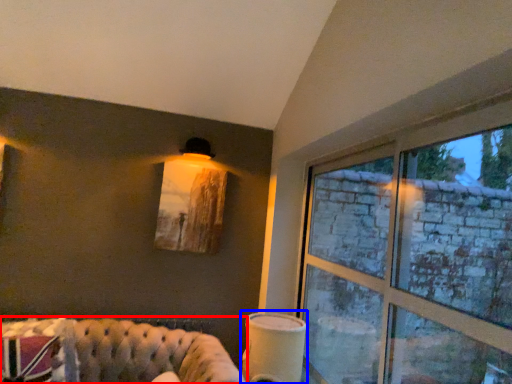
Question: Among these objects, which one is nearest to the camera, studio couch (highlighted by a red box) or table lamp (highlighted by a blue box)?

Choices:
 (A) studio couch
 (B) table lamp

Answer: (A)